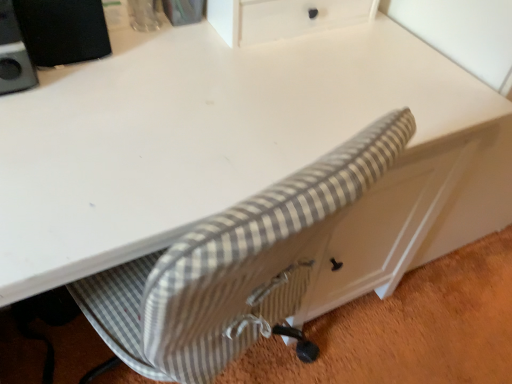
Question: Is point (84, 54) positioned closer to the camera than point (192, 274)?

Choices:
 (A) farther
 (B) closer

Answer: (A)

Question: Is black matte speaker at upper left situated inside gray striped fabric chair at lower center or outside?

Choices:
 (A) outside
 (B) inside

Answer: (A)

Question: Considering the relative positions of black matte speaker at upper left and gray striped fabric chair at lower center in the image provided, is black matte speaker at upper left to the left or to the right of gray striped fabric chair at lower center?

Choices:
 (A) right
 (B) left

Answer: (B)

Question: From a real-world perspective, is gray striped fabric chair at lower center above or below black matte speaker at upper left?

Choices:
 (A) below
 (B) above

Answer: (A)

Question: In terms of size, does gray striped fabric chair at lower center appear bigger or smaller than black matte speaker at upper left?

Choices:
 (A) big
 (B) small

Answer: (A)

Question: Based on their positions, is gray striped fabric chair at lower center located to the left or right of black matte speaker at upper left?

Choices:
 (A) right
 (B) left

Answer: (A)

Question: Considering the positions of gray striped fabric chair at lower center and black matte speaker at upper left in the image, is gray striped fabric chair at lower center taller or shorter than black matte speaker at upper left?

Choices:
 (A) short
 (B) tall

Answer: (A)